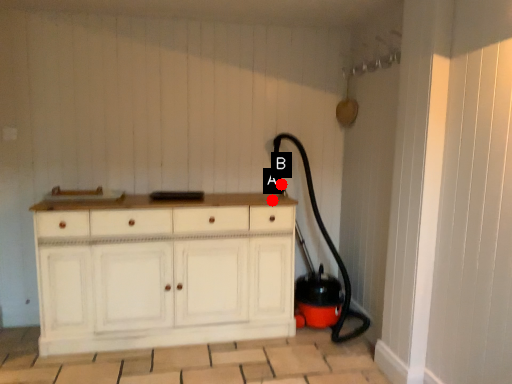
Question: Two points are circled on the image, labeled by A and B beside each circle. Which of the following is the closest to the observer?

Choices:
 (A) A is closer
 (B) B is closer

Answer: (A)